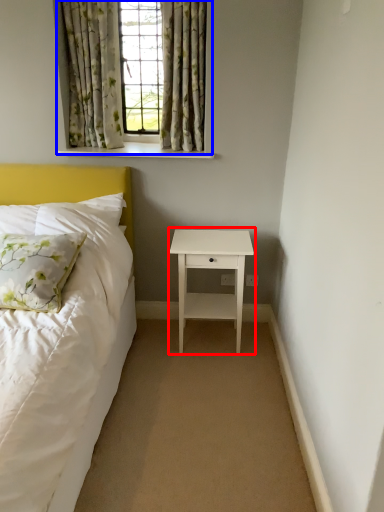
Question: Which object appears farthest to the camera in this image, nightstand (highlighted by a red box) or window (highlighted by a blue box)?

Choices:
 (A) nightstand
 (B) window

Answer: (A)